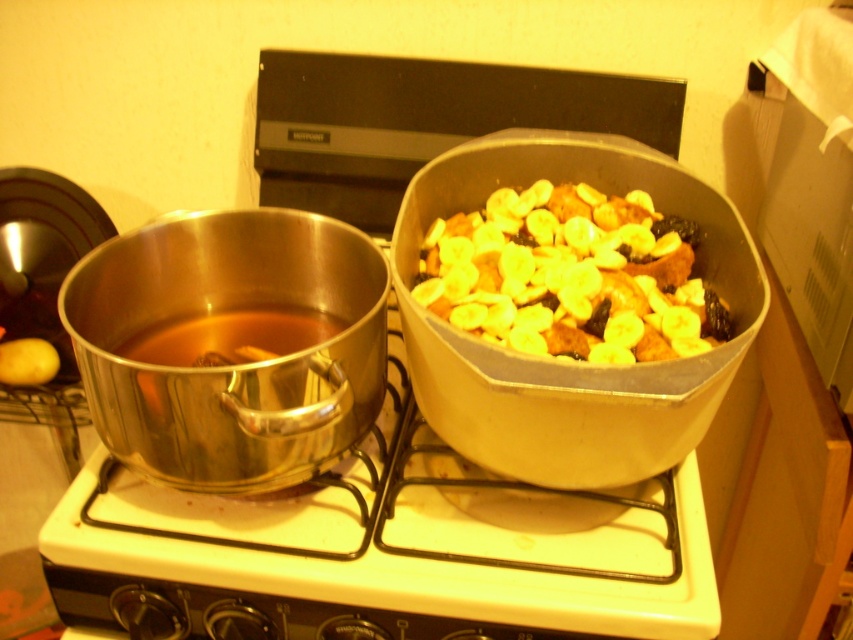
Does metallic white gas stove at center lie behind yellowish matte bananas at center?

No, metallic white gas stove at center is closer to the viewer.

Where is `metallic white gas stove at center`? metallic white gas stove at center is located at coordinates (376, 561).

Locate an element on the screen. The height and width of the screenshot is (640, 853). metallic white gas stove at center is located at coordinates (376, 561).